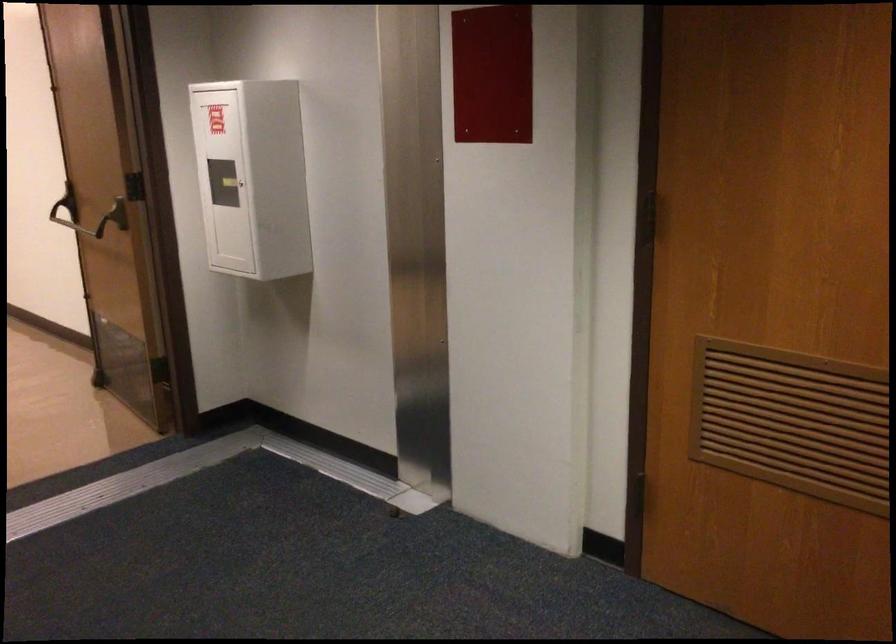
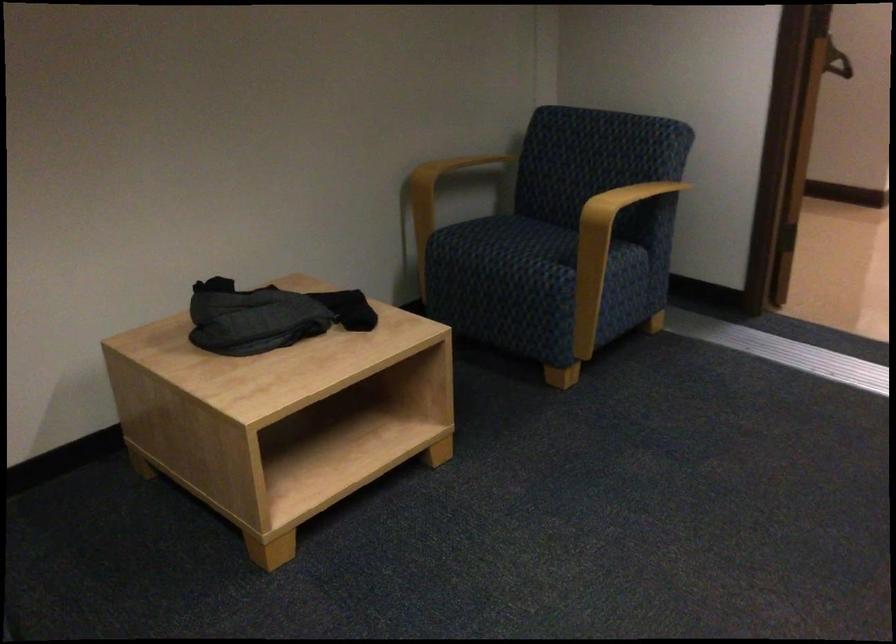
Based on the continuous images, in which direction is the camera rotating?

The camera's rotation is toward left-down.